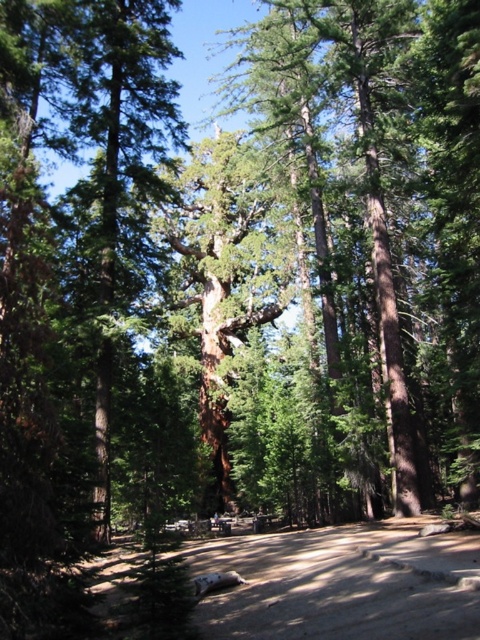
You are a hiker who wants to reach a cabin located to the east of the green rough bark tree at center. You are currently standing on the brown sandy dirt track at lower center. Which direction should you head to reach the cabin?

The brown sandy dirt track at lower center is to the right of the green rough bark tree at center. Since the cabin is east of the tree, you should head east from the track, which is already positioned to the right of the tree. However, since the track is to the right of the tree, moving east from the track would place you in the correct direction relative to the tree. Therefore, head east from your current position on the brown sandy dirt track at lower center to reach the cabin.